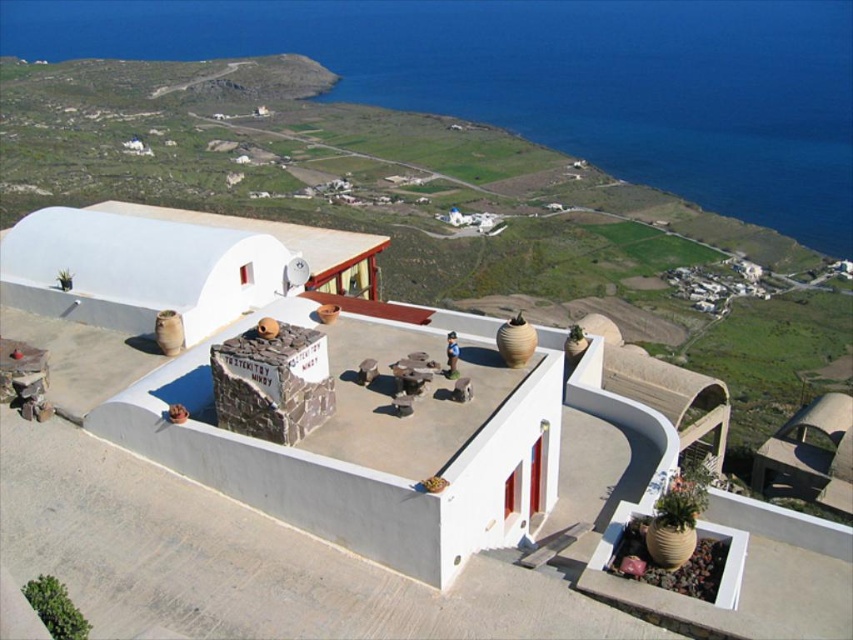
Question: Which point appears farthest from the camera in this image?

Choices:
 (A) (581, 60)
 (B) (672, 312)

Answer: (A)

Question: Is white stone hillside at upper center behind blue water at upper right?

Choices:
 (A) yes
 (B) no

Answer: (B)

Question: Which point is closer to the camera?

Choices:
 (A) blue water at upper right
 (B) white stone hillside at upper center

Answer: (B)

Question: Where is white stone hillside at upper center located in relation to blue water at upper right in the image?

Choices:
 (A) right
 (B) left

Answer: (B)

Question: Can you confirm if white stone hillside at upper center is bigger than blue water at upper right?

Choices:
 (A) yes
 (B) no

Answer: (B)